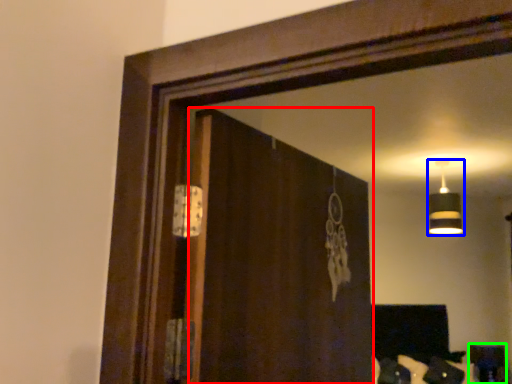
Question: Estimate the real-world distances between objects in this image. Which object is farther from screen door (highlighted by a red box), lamp (highlighted by a blue box) or furniture (highlighted by a green box)?

Choices:
 (A) lamp
 (B) furniture

Answer: (B)